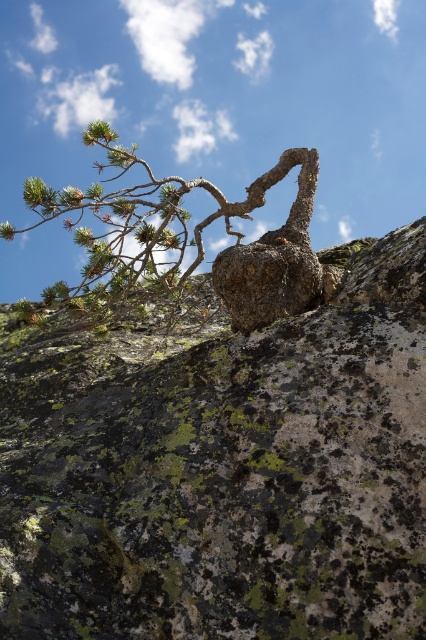
Question: Which point is farther from the camera taking this photo?

Choices:
 (A) (161, 536)
 (B) (175, 240)

Answer: (B)

Question: From the image, what is the correct spatial relationship of rough textured rock at upper left in relation to green textured rock at upper center?

Choices:
 (A) left
 (B) right

Answer: (B)

Question: Does rough textured rock at upper left have a larger size compared to green textured rock at upper center?

Choices:
 (A) no
 (B) yes

Answer: (B)

Question: Is rough textured rock at upper left thinner than green textured rock at upper center?

Choices:
 (A) no
 (B) yes

Answer: (A)

Question: Which of the following is the farthest from the observer?

Choices:
 (A) rough textured rock at upper left
 (B) green textured rock at upper center

Answer: (B)